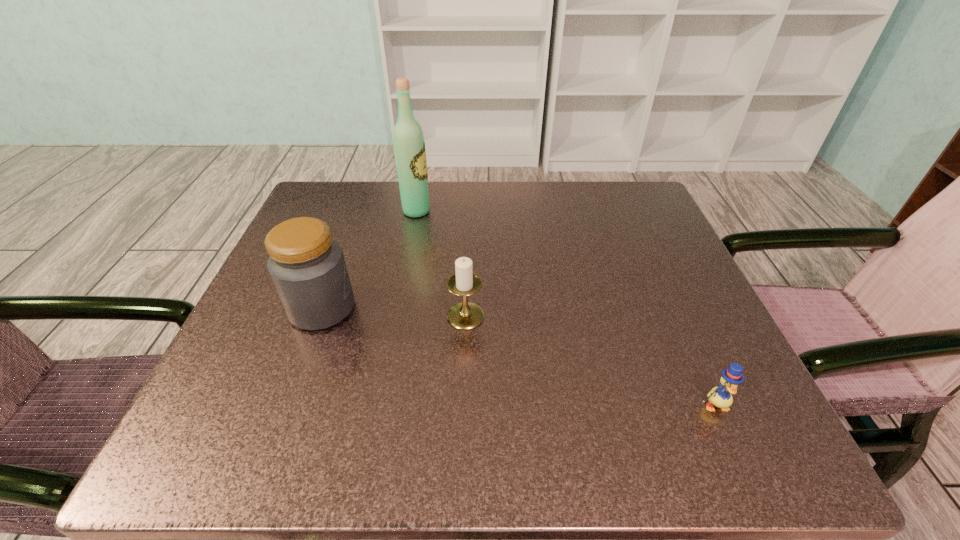
Locate an element on the screen. vacant space at the near left corner of the desktop is located at coordinates (240, 431).

Identify the location of vacant space at the far right corner of the desktop. (648, 199).

Image resolution: width=960 pixels, height=540 pixels. In the image, there is a desktop. Find the location of `free space at the near right corner`. free space at the near right corner is located at coordinates (703, 429).

I want to click on vacant area between the rightmost object and the wine bottle, so click(565, 308).

Locate an element on the screen. This screenshot has width=960, height=540. unoccupied position between the third object from left to right and the shortest object is located at coordinates (590, 360).

The width and height of the screenshot is (960, 540). I want to click on free spot between the second object from right to left and the leftmost object, so click(x=394, y=312).

Where is `vacant area that lies between the second tallest object and the second shortest object`? vacant area that lies between the second tallest object and the second shortest object is located at coordinates (394, 312).

Locate an element on the screen. This screenshot has height=540, width=960. empty space between the nearest object and the farthest object is located at coordinates (565, 308).

Find the location of a particular element. This screenshot has height=540, width=960. empty space between the second tallest object and the shortest object is located at coordinates (518, 356).

This screenshot has height=540, width=960. I want to click on unoccupied area between the wine bottle and the candle holder, so click(x=442, y=264).